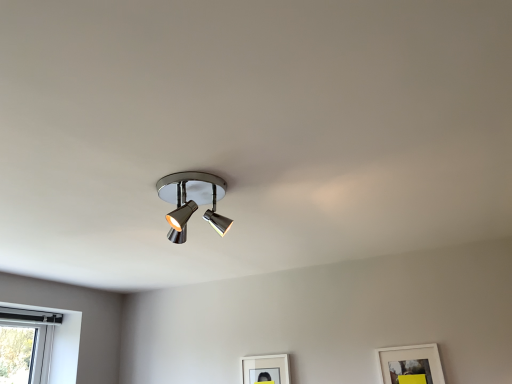
Question: Is white matte picture frame at lower right, which is the 1th picture frame in right-to-left order, bigger than matte white picture frame at lower center, which is the first picture frame from left to right?

Choices:
 (A) yes
 (B) no

Answer: (A)

Question: Does white matte picture frame at lower right, which is the second picture frame from left to right, appear on the right side of matte white picture frame at lower center, marked as the second picture frame in a right-to-left arrangement?

Choices:
 (A) yes
 (B) no

Answer: (A)

Question: From the image's perspective, is white matte picture frame at lower right, which is the 1th picture frame in right-to-left order, below matte white picture frame at lower center, the 1th picture frame in the back-to-front sequence?

Choices:
 (A) no
 (B) yes

Answer: (A)

Question: Considering the relative sizes of white matte picture frame at lower right, the first picture frame positioned from the front, and matte white picture frame at lower center, the second picture frame in the front-to-back sequence, in the image provided, is white matte picture frame at lower right, the first picture frame positioned from the front, smaller than matte white picture frame at lower center, the second picture frame in the front-to-back sequence,?

Choices:
 (A) no
 (B) yes

Answer: (A)

Question: From a real-world perspective, is white matte picture frame at lower right, marked as the 2th picture frame in a back-to-front arrangement, beneath matte white picture frame at lower center, the 1th picture frame in the back-to-front sequence?

Choices:
 (A) yes
 (B) no

Answer: (A)

Question: From a real-world perspective, is polished chrome spotlight at center positioned above or below matte white picture frame at lower center, marked as the second picture frame in a right-to-left arrangement?

Choices:
 (A) above
 (B) below

Answer: (A)

Question: From the image's perspective, is polished chrome spotlight at center above or below matte white picture frame at lower center, the second picture frame in the front-to-back sequence?

Choices:
 (A) above
 (B) below

Answer: (A)

Question: Is polished chrome spotlight at center in front of or behind matte white picture frame at lower center, which is the first picture frame from left to right, in the image?

Choices:
 (A) behind
 (B) front

Answer: (B)

Question: Do you think polished chrome spotlight at center is within matte white picture frame at lower center, which is the first picture frame from left to right, or outside of it?

Choices:
 (A) outside
 (B) inside

Answer: (A)

Question: From the image's perspective, is white matte picture frame at lower right, the first picture frame positioned from the front, positioned above or below polished chrome spotlight at center?

Choices:
 (A) below
 (B) above

Answer: (A)

Question: Looking at their shapes, would you say white matte picture frame at lower right, which is the second picture frame from left to right, is wider or thinner than polished chrome spotlight at center?

Choices:
 (A) thin
 (B) wide

Answer: (A)

Question: Based on their positions, is white matte picture frame at lower right, which is the 1th picture frame in right-to-left order, located to the left or right of polished chrome spotlight at center?

Choices:
 (A) left
 (B) right

Answer: (B)

Question: From their relative heights in the image, would you say white matte picture frame at lower right, which is the 1th picture frame in right-to-left order, is taller or shorter than polished chrome spotlight at center?

Choices:
 (A) short
 (B) tall

Answer: (B)

Question: From their relative heights in the image, would you say white matte picture frame at lower right, marked as the 2th picture frame in a back-to-front arrangement, is taller or shorter than matte white picture frame at lower center, the 1th picture frame in the back-to-front sequence?

Choices:
 (A) short
 (B) tall

Answer: (B)

Question: Is white matte picture frame at lower right, which is the second picture frame from left to right, bigger or smaller than matte white picture frame at lower center, marked as the second picture frame in a right-to-left arrangement?

Choices:
 (A) big
 (B) small

Answer: (A)